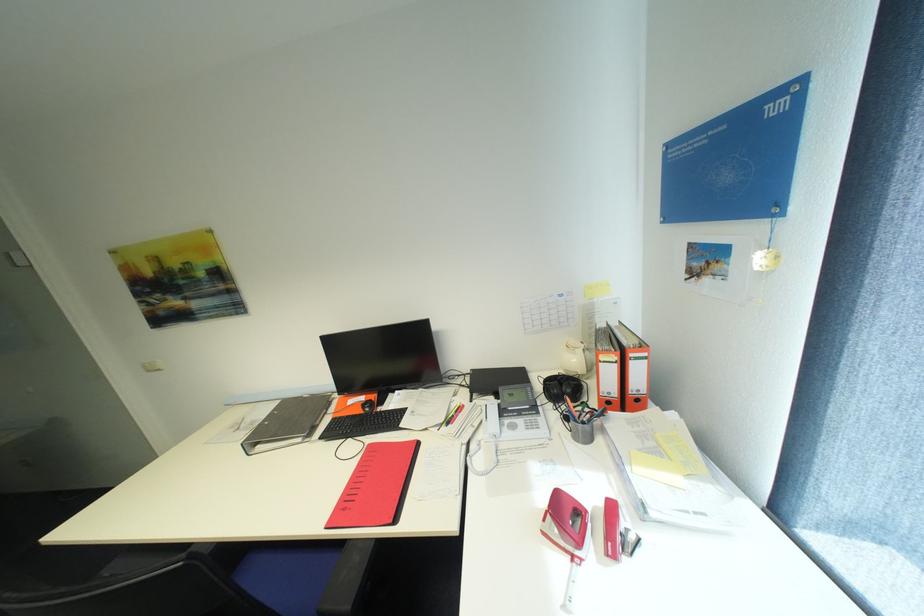
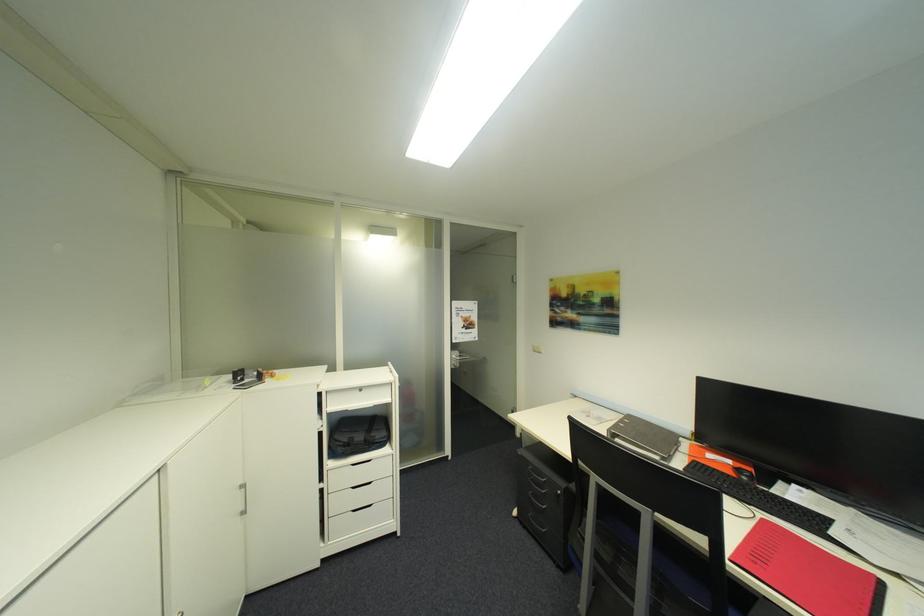
The point at (371, 399) is marked in the first image. Where is the corresponding point in the second image?

(736, 463)